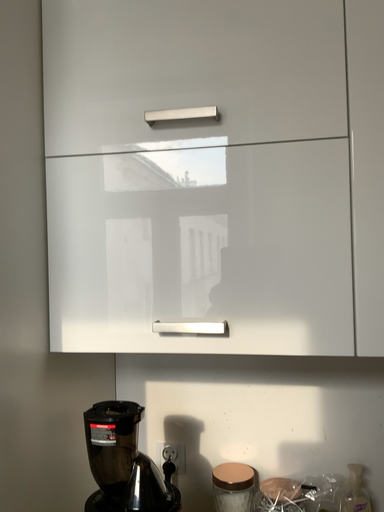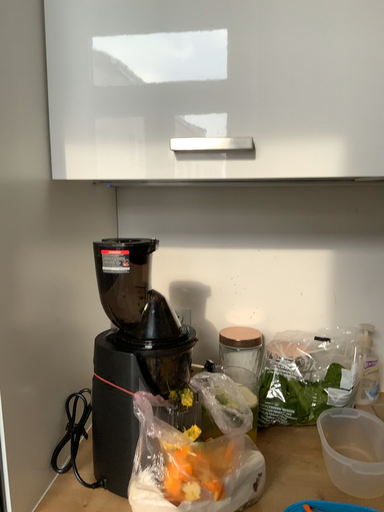
Question: How did the camera likely rotate when shooting the video?

Choices:
 (A) rotated upward
 (B) rotated downward

Answer: (B)